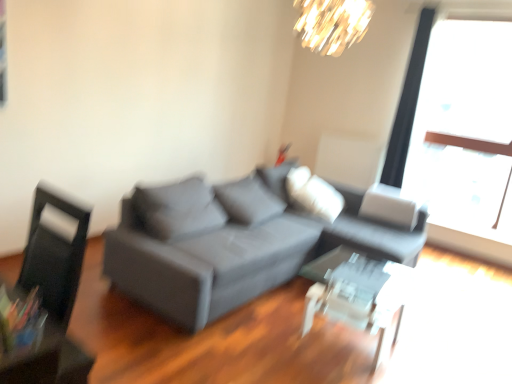
Question: Is transparent glass table at center to the left of shiny gold chandelier at upper center from the viewer's perspective?

Choices:
 (A) no
 (B) yes

Answer: (A)

Question: Considering the relative sizes of transparent glass table at center and shiny gold chandelier at upper center in the image provided, is transparent glass table at center thinner than shiny gold chandelier at upper center?

Choices:
 (A) no
 (B) yes

Answer: (A)

Question: Is there a large distance between transparent glass table at center and shiny gold chandelier at upper center?

Choices:
 (A) no
 (B) yes

Answer: (B)

Question: From the image's perspective, would you say transparent glass table at center is shown under shiny gold chandelier at upper center?

Choices:
 (A) no
 (B) yes

Answer: (B)

Question: Are transparent glass table at center and shiny gold chandelier at upper center making contact?

Choices:
 (A) yes
 (B) no

Answer: (B)

Question: Can you confirm if transparent glass table at center is shorter than shiny gold chandelier at upper center?

Choices:
 (A) yes
 (B) no

Answer: (B)

Question: Considering the relative sizes of transparent glass table at center and black leather swivel chair at left in the image provided, is transparent glass table at center smaller than black leather swivel chair at left?

Choices:
 (A) no
 (B) yes

Answer: (A)

Question: Does transparent glass table at center have a lesser height compared to black leather swivel chair at left?

Choices:
 (A) yes
 (B) no

Answer: (A)

Question: From a real-world perspective, is transparent glass table at center over black leather swivel chair at left?

Choices:
 (A) no
 (B) yes

Answer: (A)

Question: Does transparent glass table at center appear on the right side of black leather swivel chair at left?

Choices:
 (A) no
 (B) yes

Answer: (B)

Question: Is there a large distance between transparent glass table at center and black leather swivel chair at left?

Choices:
 (A) yes
 (B) no

Answer: (A)

Question: Is transparent glass table at center positioned before black leather swivel chair at left?

Choices:
 (A) no
 (B) yes

Answer: (A)

Question: Can you confirm if black leather swivel chair at left is bigger than matte gray couch at center?

Choices:
 (A) no
 (B) yes

Answer: (A)